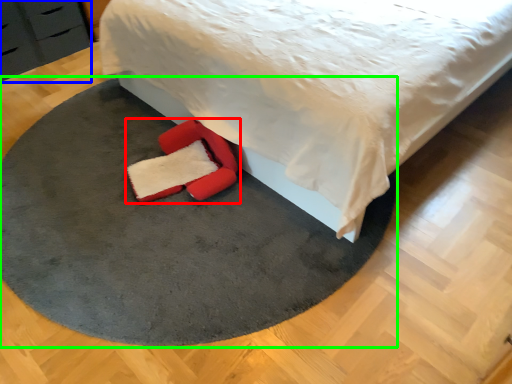
Question: Estimate the real-world distances between objects in this image. Which object is closer to footwear (highlighted by a red box), dresser (highlighted by a blue box) or mat (highlighted by a green box)?

Choices:
 (A) dresser
 (B) mat

Answer: (B)